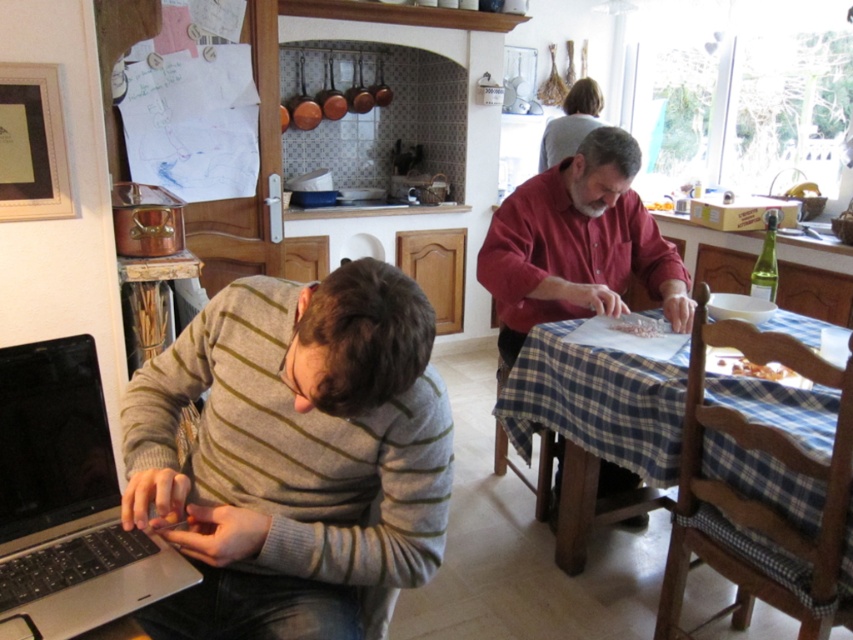
Question: Is golden crispy pastry at table bigger than white crumbly food at table?

Choices:
 (A) no
 (B) yes

Answer: (B)

Question: Which is nearer to the white crumbly food at table?

Choices:
 (A) silver metallic laptop at lower left
 (B) light gray sweater at upper center

Answer: (A)

Question: Can you confirm if blue checkered tablecloth at center is wider than white crumbly food at table?

Choices:
 (A) no
 (B) yes

Answer: (B)

Question: Estimate the real-world distances between objects in this image. Which object is farther from the white crumbly food at table?

Choices:
 (A) light gray sweater at upper center
 (B) blue checkered tablecloth at center

Answer: (A)

Question: Can you confirm if silver metallic laptop at lower left is wider than golden crispy pastry at table?

Choices:
 (A) no
 (B) yes

Answer: (B)

Question: Which object is positioned farthest from the golden crispy pastry at table?

Choices:
 (A) white crumbly food at table
 (B) light gray sweater at upper center

Answer: (B)